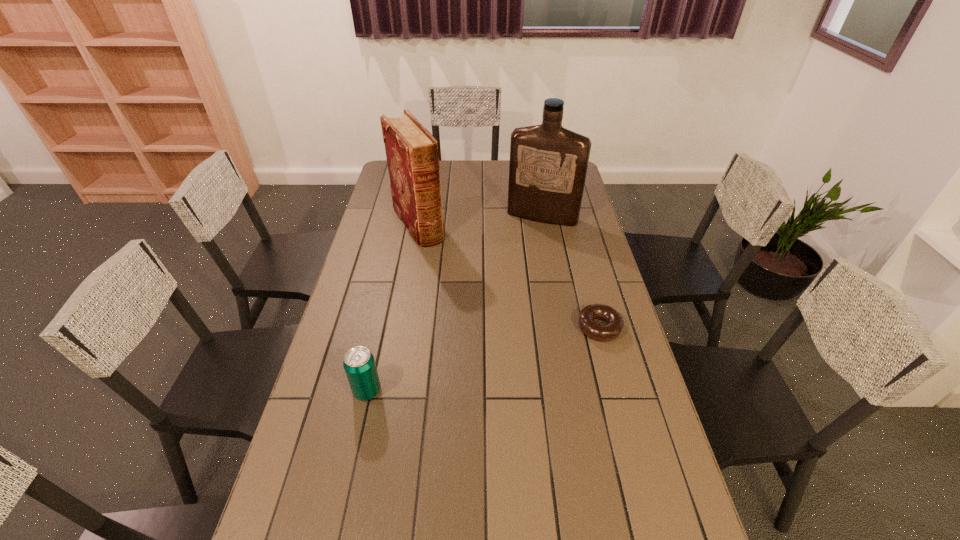
In order to click on empty space between the shortest object and the hardback book in this screenshot , I will do `click(509, 275)`.

Image resolution: width=960 pixels, height=540 pixels. What are the coordinates of `vacant area between the hardback book and the liquor` in the screenshot? It's located at (480, 220).

This screenshot has width=960, height=540. I want to click on object that is the second closest to the third tallest object, so click(x=412, y=154).

The height and width of the screenshot is (540, 960). Identify the location of object that can be found as the closest to the third tallest object. (615, 323).

You are a GUI agent. You are given a task and a screenshot of the screen. Output one action in this format:
    pyautogui.click(x=<x>, y=<y>)
    Task: Click on the free space that satisfies the following two spatial constraints: 1. on the back side of the hardback book; 2. on the left side of the second shortest object
    This screenshot has height=540, width=960.
    Given the screenshot: What is the action you would take?
    pyautogui.click(x=404, y=224)